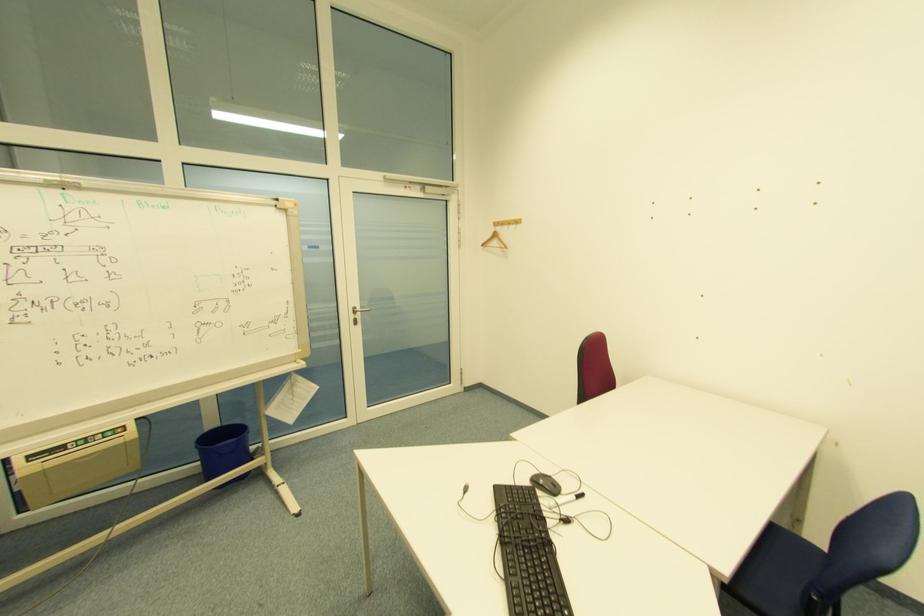
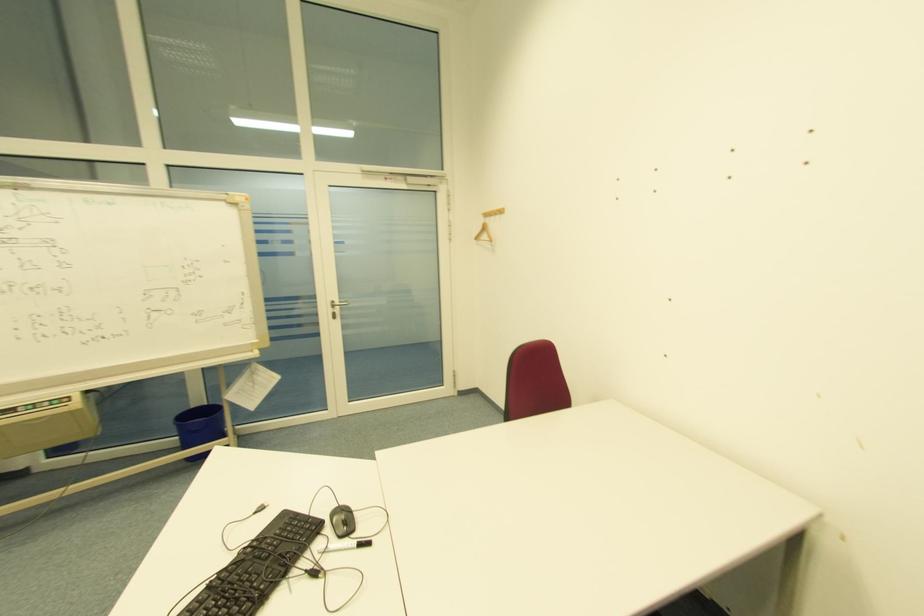
From the picture: The images are taken continuously from a first-person perspective. In which direction are you moving?

The cameraman walked toward right, forward.